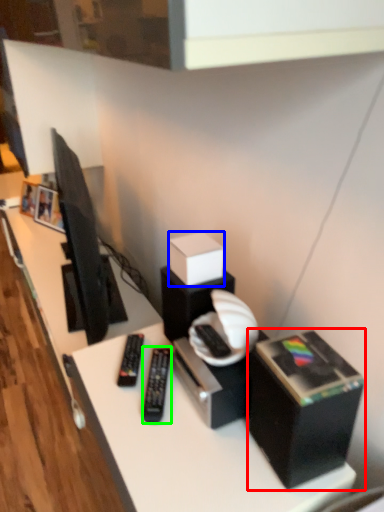
Question: Considering the real-world distances, which object is closest to box (highlighted by a red box)? box (highlighted by a blue box) or equipment (highlighted by a green box).

Choices:
 (A) box
 (B) equipment

Answer: (B)